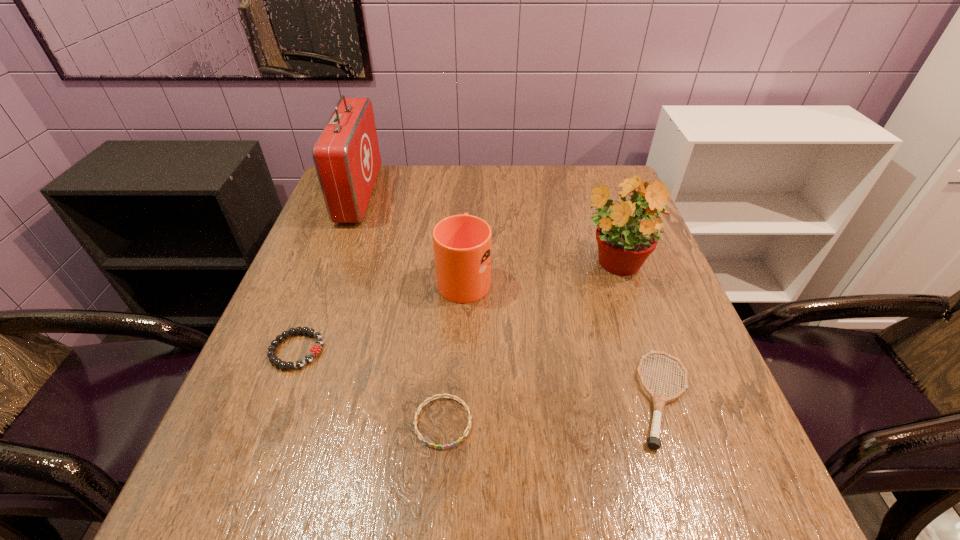
Where is `empty space between the third tallest object and the flowerpot`? empty space between the third tallest object and the flowerpot is located at coordinates (539, 271).

I want to click on free area in between the fifth tallest object and the tennis racket, so click(480, 374).

The height and width of the screenshot is (540, 960). I want to click on free spot between the third tallest object and the flowerpot, so click(x=539, y=271).

You are a GUI agent. You are given a task and a screenshot of the screen. Output one action in this format:
    pyautogui.click(x=<x>, y=<y>)
    Task: Click on the empty space that is in between the right bracelet and the first-aid kit
    This screenshot has height=540, width=960.
    Given the screenshot: What is the action you would take?
    pyautogui.click(x=401, y=308)

You are a GUI agent. You are given a task and a screenshot of the screen. Output one action in this format:
    pyautogui.click(x=<x>, y=<y>)
    Task: Click on the unoccupied area between the third shortest object and the first-aid kit
    Image resolution: width=960 pixels, height=540 pixels.
    Given the screenshot: What is the action you would take?
    pyautogui.click(x=512, y=297)

Image resolution: width=960 pixels, height=540 pixels. Identify the location of free spot between the nearer bracelet and the farthest object. (401, 308).

Identify the location of vacant area that lies between the fourth tallest object and the farthest object. The image size is (960, 540). 512,297.

Find the location of a particular element. The height and width of the screenshot is (540, 960). free space between the tennis racket and the flowerpot is located at coordinates (638, 332).

You are a GUI agent. You are given a task and a screenshot of the screen. Output one action in this format:
    pyautogui.click(x=<x>, y=<y>)
    Task: Click on the free space between the nearer bracelet and the tennis racket
    
    Given the screenshot: What is the action you would take?
    pyautogui.click(x=553, y=410)

Choose which object is the third nearest neighbor to the first-aid kit. Please provide its 2D coordinates. Your answer should be formatted as a tuple, i.e. [(x, y)], where the tuple contains the x and y coordinates of a point satisfying the conditions above.

[(624, 243)]